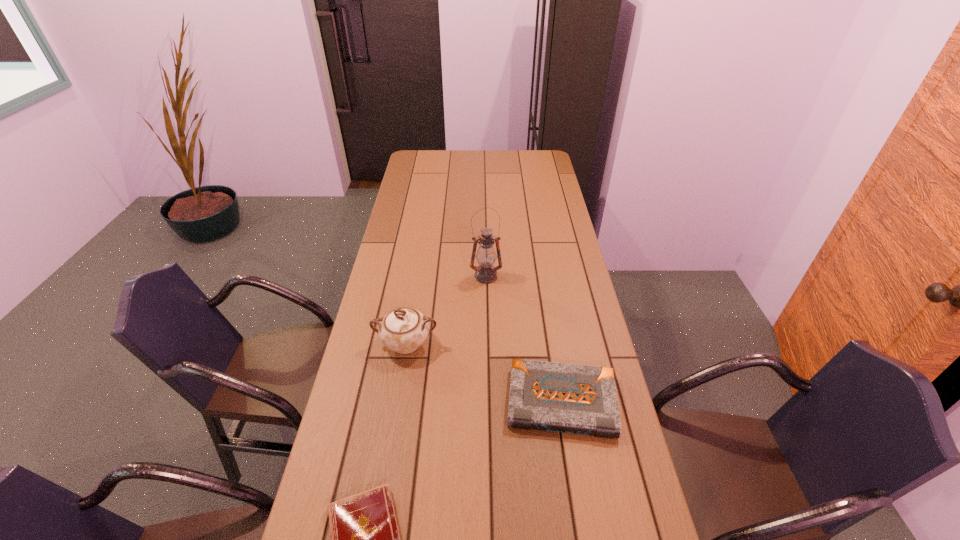
This screenshot has height=540, width=960. What are the coordinates of `object at the right edge` in the screenshot? It's located at (579, 399).

The height and width of the screenshot is (540, 960). I want to click on vacant region at the far edge of the desktop, so click(x=514, y=171).

The height and width of the screenshot is (540, 960). I want to click on free spot at the left edge of the desktop, so click(401, 292).

The height and width of the screenshot is (540, 960). Identify the location of vacant space at the right edge of the desktop. (543, 173).

The width and height of the screenshot is (960, 540). Find the location of `blank space at the far left corner of the desktop`. blank space at the far left corner of the desktop is located at coordinates (431, 164).

Locate an element on the screen. free area in between the second nearest object and the oil lamp is located at coordinates (524, 339).

This screenshot has height=540, width=960. What are the coordinates of `free spot between the tallest object and the chinaware` in the screenshot? It's located at (446, 310).

Find the location of a particular element. vacant area between the farther notebook and the third shortest object is located at coordinates (484, 373).

What are the coordinates of `unoccupied area between the third nearest object and the tallest object` in the screenshot? It's located at (446, 310).

At what (x,y) coordinates should I click in order to perform the action: click on free space between the tallest object and the third tallest object. Please return your answer as a coordinate pair (x, y). Looking at the image, I should click on (524, 339).